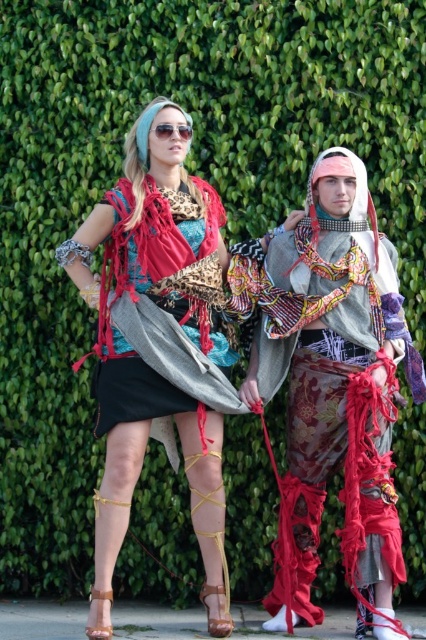
What are the coordinates of the leopard print scarf at center?

The leopard print scarf at center is located at coordinates point [158,346].